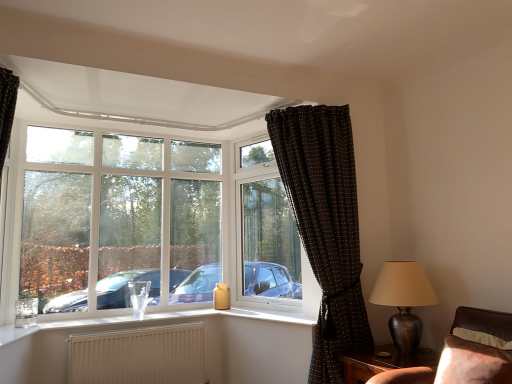
Identify the location of free space above white plastic window at upper left (from a real-world perspective). (95, 130).